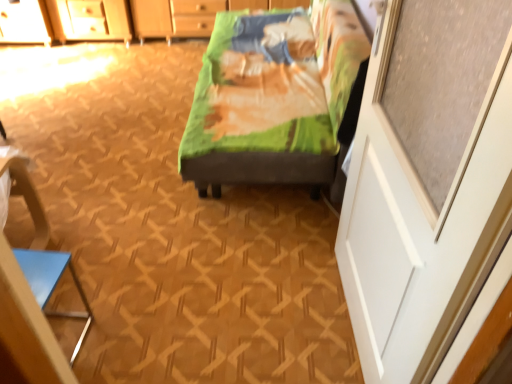
Question: From a real-world perspective, is white matte screen door at right over green fabric bed at center?

Choices:
 (A) no
 (B) yes

Answer: (B)

Question: Could green fabric bed at center be considered to be inside white matte screen door at right?

Choices:
 (A) no
 (B) yes

Answer: (A)

Question: Is white matte screen door at right bigger than green fabric bed at center?

Choices:
 (A) no
 (B) yes

Answer: (A)

Question: Does white matte screen door at right have a smaller size compared to green fabric bed at center?

Choices:
 (A) yes
 (B) no

Answer: (A)

Question: Does white matte screen door at right appear on the right side of green fabric bed at center?

Choices:
 (A) yes
 (B) no

Answer: (A)

Question: Is white matte screen door at right beside green fabric bed at center?

Choices:
 (A) yes
 (B) no

Answer: (B)

Question: Is white matte screen door at right at the right side of blue glossy triangle at lower left?

Choices:
 (A) no
 (B) yes

Answer: (B)

Question: From a real-world perspective, is white matte screen door at right located higher than blue glossy triangle at lower left?

Choices:
 (A) no
 (B) yes

Answer: (B)

Question: From a real-world perspective, is white matte screen door at right below blue glossy triangle at lower left?

Choices:
 (A) yes
 (B) no

Answer: (B)

Question: From the image's perspective, would you say white matte screen door at right is positioned over blue glossy triangle at lower left?

Choices:
 (A) no
 (B) yes

Answer: (B)

Question: Is white matte screen door at right placed right next to blue glossy triangle at lower left?

Choices:
 (A) no
 (B) yes

Answer: (A)

Question: Is white matte screen door at right smaller than blue glossy triangle at lower left?

Choices:
 (A) no
 (B) yes

Answer: (A)

Question: Considering the relative sizes of blue glossy triangle at lower left and white matte screen door at right in the image provided, is blue glossy triangle at lower left taller than white matte screen door at right?

Choices:
 (A) yes
 (B) no

Answer: (B)